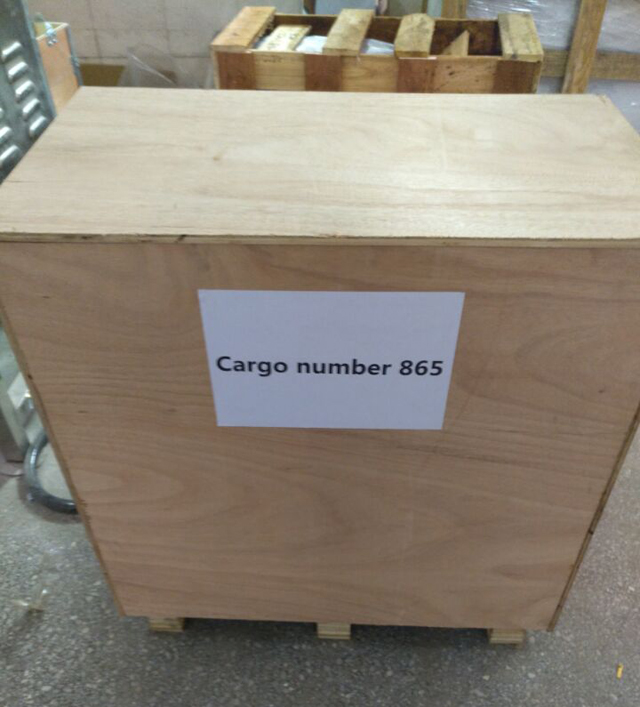
You are a GUI agent. You are given a task and a screenshot of the screen. Output one action in this format:
    pyautogui.click(x=<x>, y=<y>)
    Task: Click on the white back wall
    
    Given the screenshot: What is the action you would take?
    pyautogui.click(x=191, y=18)